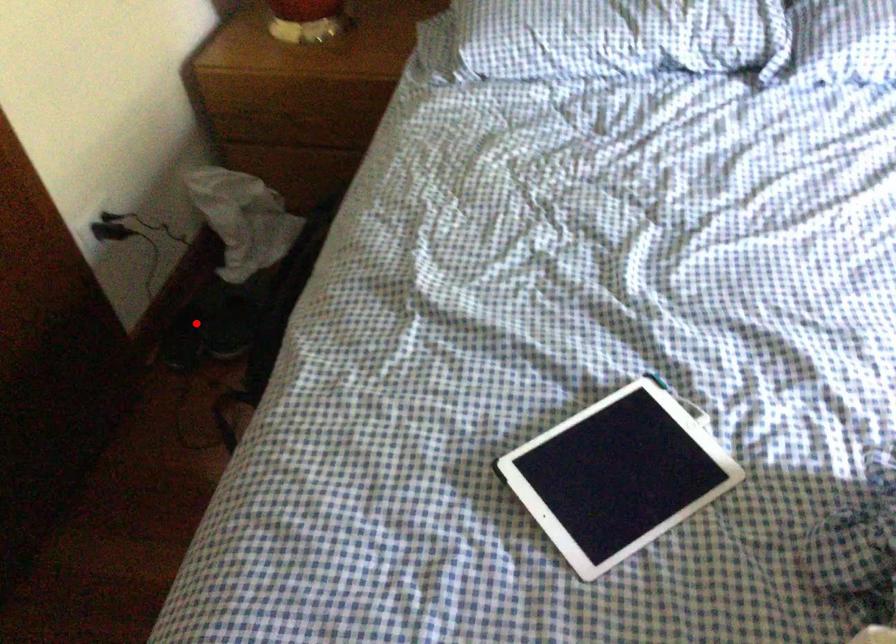
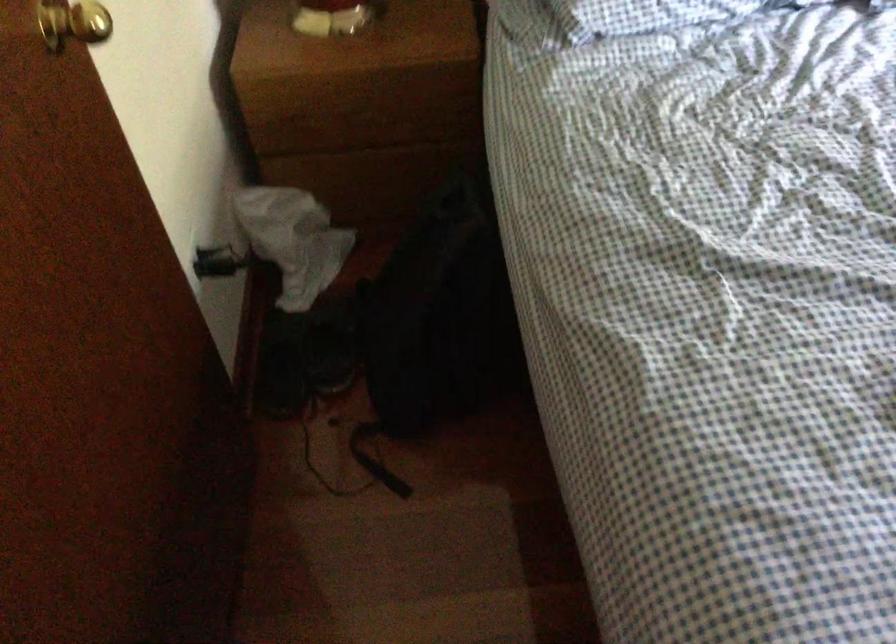
In the second image, find the point that corresponds to the highlighted location in the first image.

(282, 363)